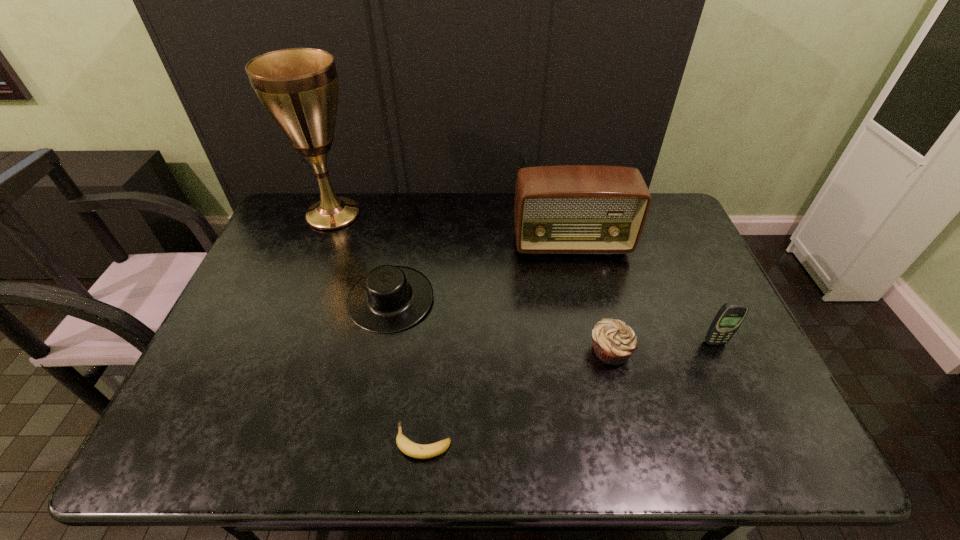
The width and height of the screenshot is (960, 540). I want to click on object that is at the far left corner, so (x=298, y=87).

The image size is (960, 540). Identify the location of vacant space at the far edge of the desktop. (355, 220).

In the image, there is a desktop. Where is `vacant area at the near edge`? vacant area at the near edge is located at coordinates (590, 461).

You are a GUI agent. You are given a task and a screenshot of the screen. Output one action in this format:
    pyautogui.click(x=<x>, y=<y>)
    Task: Click on the free space at the left edge of the desktop
    The image size is (960, 540).
    Given the screenshot: What is the action you would take?
    pyautogui.click(x=223, y=382)

Where is `vacant area at the near left corner`? vacant area at the near left corner is located at coordinates (208, 462).

The width and height of the screenshot is (960, 540). I want to click on free point between the dress hat and the cellular telephone, so click(553, 321).

Find the location of a particular element. This screenshot has height=540, width=960. free point between the fourth shortest object and the banana is located at coordinates (569, 392).

Image resolution: width=960 pixels, height=540 pixels. In order to click on vacant area that lies between the muffin and the rightmost object in this screenshot , I will do `click(662, 347)`.

Where is `empty space that is in between the dress hat and the third tallest object`? The height and width of the screenshot is (540, 960). empty space that is in between the dress hat and the third tallest object is located at coordinates (553, 321).

At what (x,y) coordinates should I click in order to perform the action: click on empty space between the third tallest object and the nearest object. Please return your answer as a coordinate pair (x, y). Looking at the image, I should click on (569, 392).